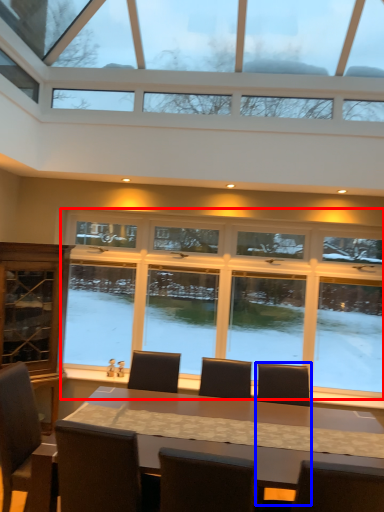
Question: Which point is further to the camera, window (highlighted by a red box) or armchair (highlighted by a blue box)?

Choices:
 (A) window
 (B) armchair

Answer: (A)